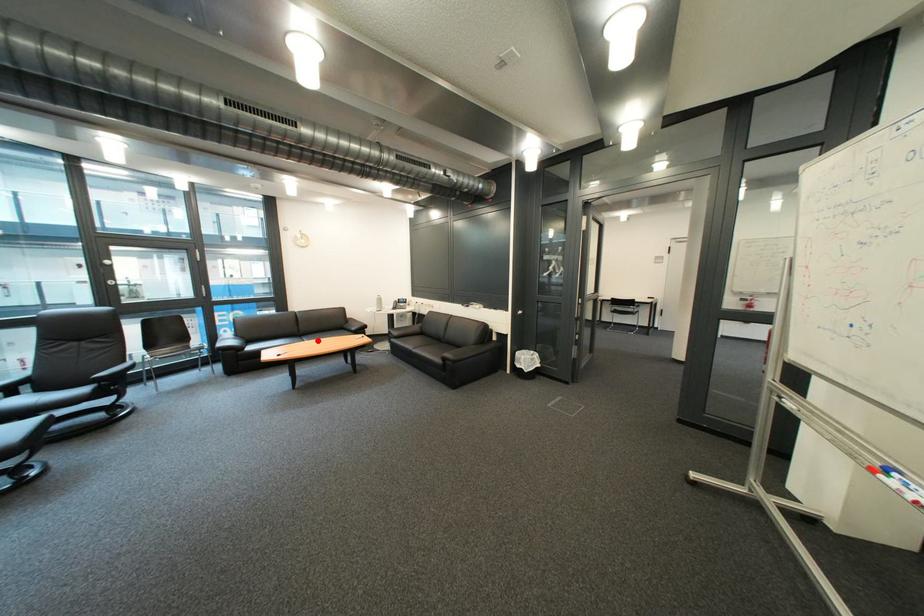
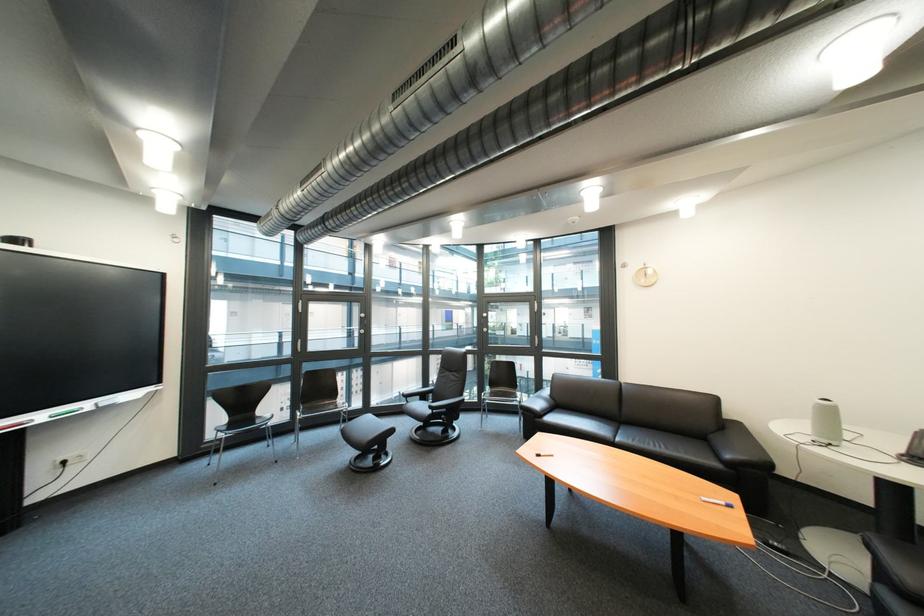
The point at the highlighted location is marked in the first image. Where is the corresponding point in the second image?

(634, 434)